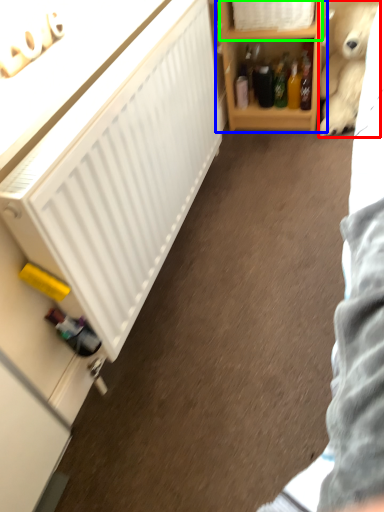
Question: Which is nearer to the teddy bear (highlighted by a red box)? shelf (highlighted by a blue box) or cabinet (highlighted by a green box).

Choices:
 (A) shelf
 (B) cabinet

Answer: (A)